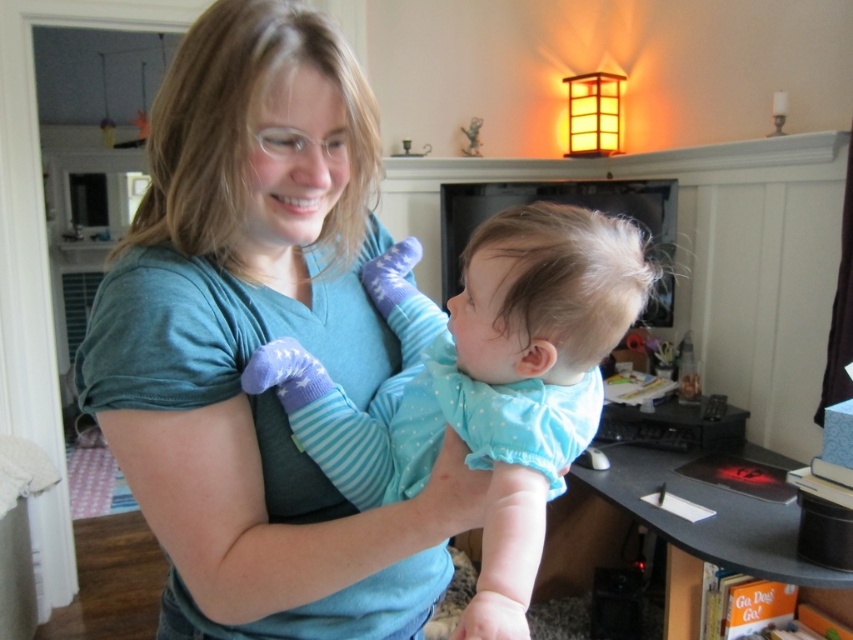
Question: Is matte teal shirt at center above light blue fabric baby at center?

Choices:
 (A) no
 (B) yes

Answer: (A)

Question: Can you confirm if matte teal shirt at center is smaller than light blue fabric baby at center?

Choices:
 (A) no
 (B) yes

Answer: (A)

Question: Which object appears closest to the camera in this image?

Choices:
 (A) matte teal shirt at center
 (B) light blue fabric baby at center

Answer: (B)

Question: Does matte teal shirt at center have a lesser width compared to light blue fabric baby at center?

Choices:
 (A) no
 (B) yes

Answer: (B)